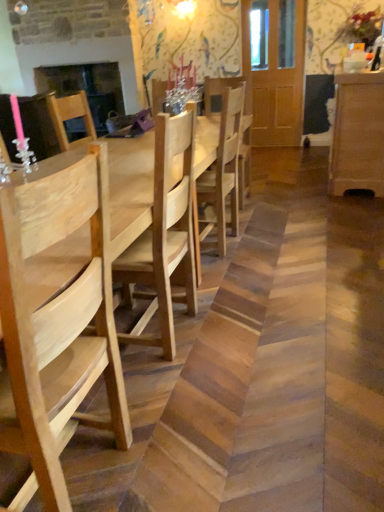
Question: In terms of size, does light brown wood dresser at right appear bigger or smaller than matte black fireplace at upper left?

Choices:
 (A) small
 (B) big

Answer: (B)

Question: In terms of width, does light brown wood dresser at right look wider or thinner when compared to matte black fireplace at upper left?

Choices:
 (A) wide
 (B) thin

Answer: (A)

Question: Estimate the real-world distances between objects in this image. Which object is closer to the matte black fireplace at upper left?

Choices:
 (A) natural wood chair at center, marked as the second chair in a front-to-back arrangement
 (B) natural wood chair at center, the 2th chair when ordered from right to left
 (C) natural wood table at center
 (D) light brown wood dresser at right

Answer: (A)

Question: Which is farther from the natural wood chair at center, which appears as the 1th chair when viewed from the right?

Choices:
 (A) matte black fireplace at upper left
 (B) natural wood chair at center, arranged as the 1th chair when viewed from the left
 (C) natural wood table at center
 (D) light brown wood dresser at right

Answer: (A)